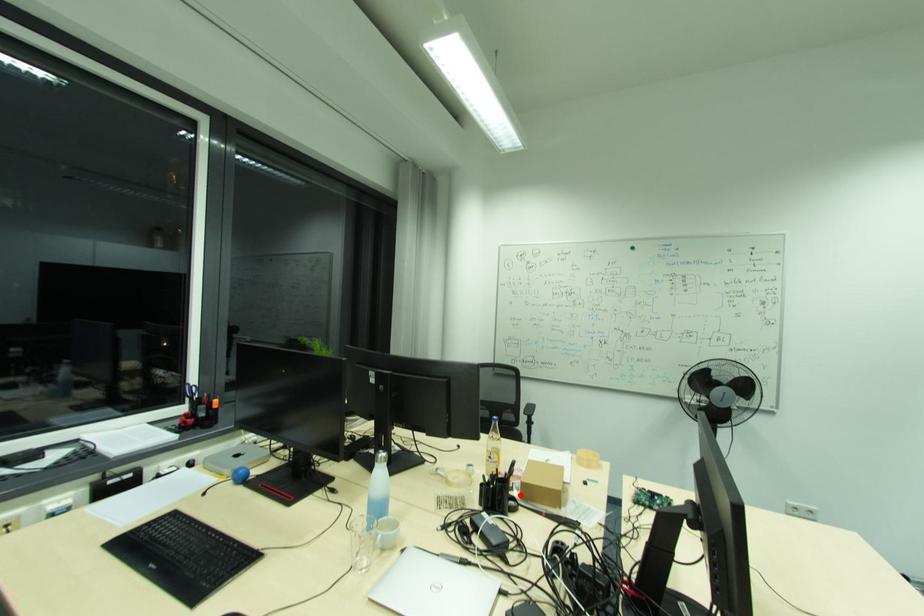
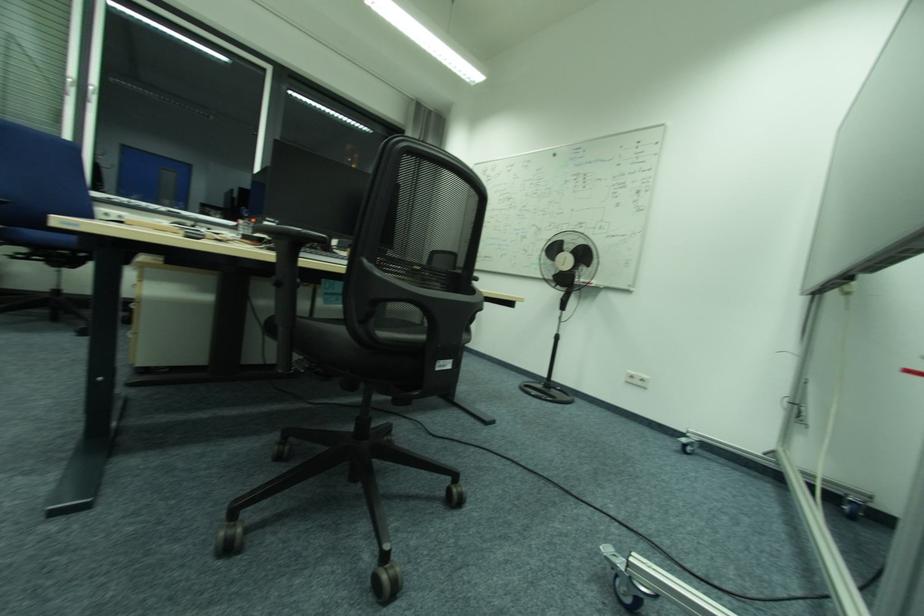
Question: I am providing you with two images of the same scene from different viewpoints. A red point is marked on the first image. Can you still see the location of the red point in image 2?

Choices:
 (A) Yes
 (B) No

Answer: (B)